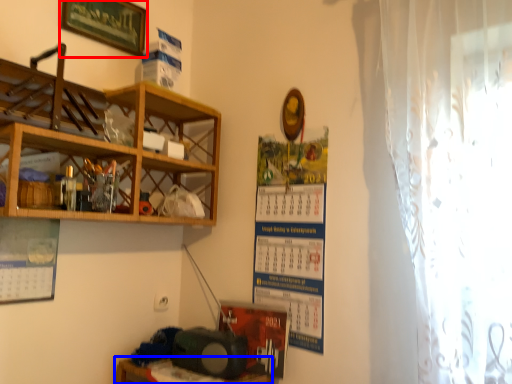
Question: Which object appears closest to the camera in this image, picture frame (highlighted by a red box) or table (highlighted by a blue box)?

Choices:
 (A) picture frame
 (B) table

Answer: (B)